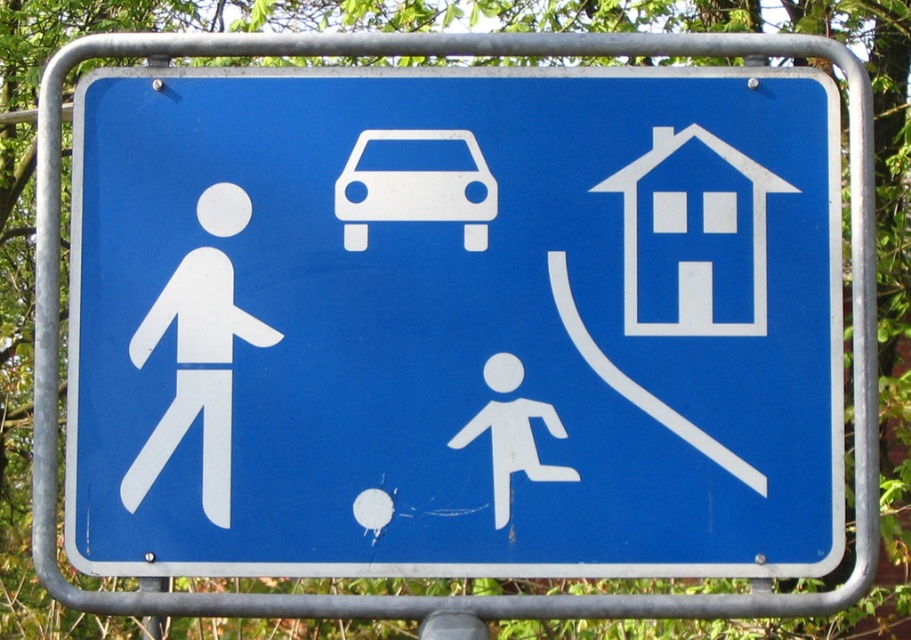
Question: Estimate the real-world distances between objects in this image. Which object is closer to the white matte car at center?

Choices:
 (A) white paper figure at left
 (B) blue plastic sign at center

Answer: (B)

Question: Is white paper figure at left further to camera compared to white matte car at center?

Choices:
 (A) no
 (B) yes

Answer: (A)

Question: Which point is farther to the camera?

Choices:
 (A) white matte car at center
 (B) blue plastic sign at center
 (C) white paper figure at left

Answer: (A)

Question: Does blue plastic sign at center have a greater width compared to white paper figure at left?

Choices:
 (A) yes
 (B) no

Answer: (A)

Question: Which point is closer to the camera?

Choices:
 (A) white paper figure at left
 (B) white matte car at center
 (C) blue plastic sign at center

Answer: (C)

Question: Is the position of blue plastic sign at center less distant than that of white matte car at center?

Choices:
 (A) yes
 (B) no

Answer: (A)